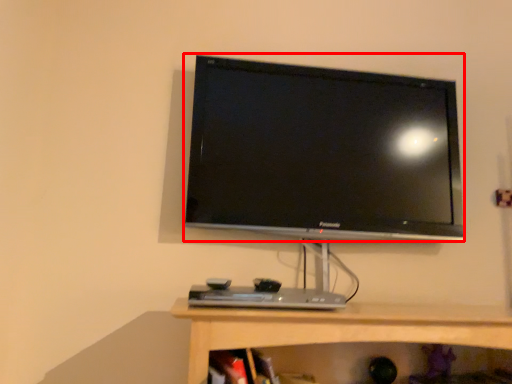
Question: From the image, what is the correct spatial relationship of television (annotated by the red box) in relation to desktop?

Choices:
 (A) left
 (B) right

Answer: (B)